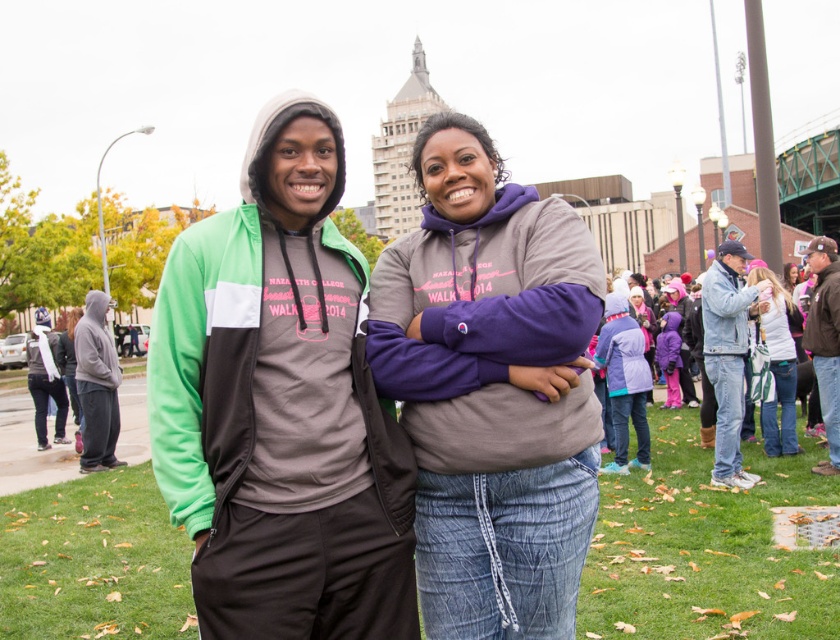
You are a photographer trying to capture a clear shot of both the purple fleece jacket at lower right and the gray fleece sweatshirt at left. Based on their positions, which one will appear larger in your photo?

The purple fleece jacket at lower right will appear larger in the photo because it is closer to the viewer than the gray fleece sweatshirt at left.

You are a photographer trying to capture both the denim jacket at lower right and the white fleece jacket at right in a single frame. Which jacket will appear taller in the photo?

The denim jacket at lower right has a greater height compared to the white fleece jacket at right, so it will appear taller in the photo.